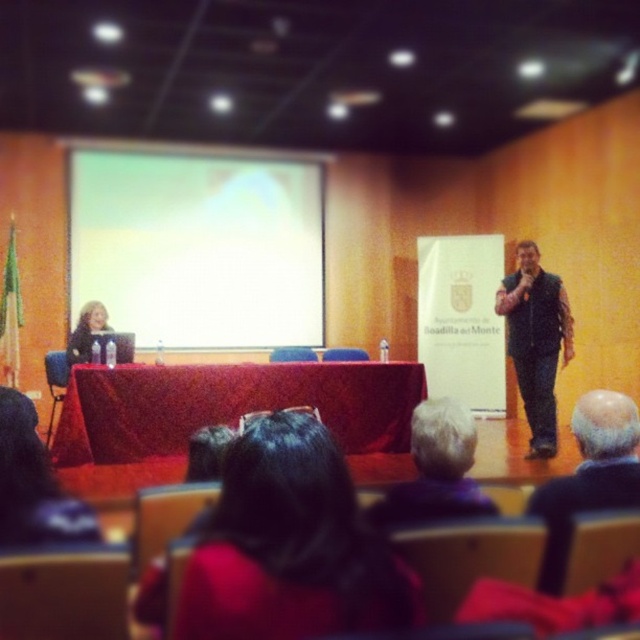
You are an event organizer setting up a presentation. You have a white matte projection screen at upper center and a matte black laptop at left. Which object is taller?

The white matte projection screen at upper center is much taller than the matte black laptop at left.

You are an attendee at this conference. You want to take a photo of the speaker on the right side of the stage. However, there is a point at coordinates (x=289, y=545) in the image that might block your view. Is this point likely to obstruct your photo of the speaker?

The point at coordinates (x=289, y=545) indicates dark hair at center, which is located at the center of the image. Since the speaker is on the right side of the stage, the dark hair at center would not obstruct the view of the speaker on the right side.

You are sitting in the audience and want to know which of the two points, point (150, 275) or point (88, 324), is closer to you. Based on the stage setup, which point is nearer?

Point (150, 275) is further to the camera than point (88, 324), so the point closer to you is point (88, 324).